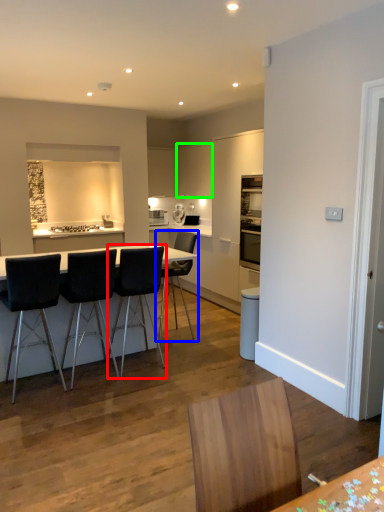
Question: Estimate the real-world distances between objects in this image. Which object is farther from chair (highlighted by a red box), chair (highlighted by a blue box) or cabinetry (highlighted by a green box)?

Choices:
 (A) chair
 (B) cabinetry

Answer: (B)